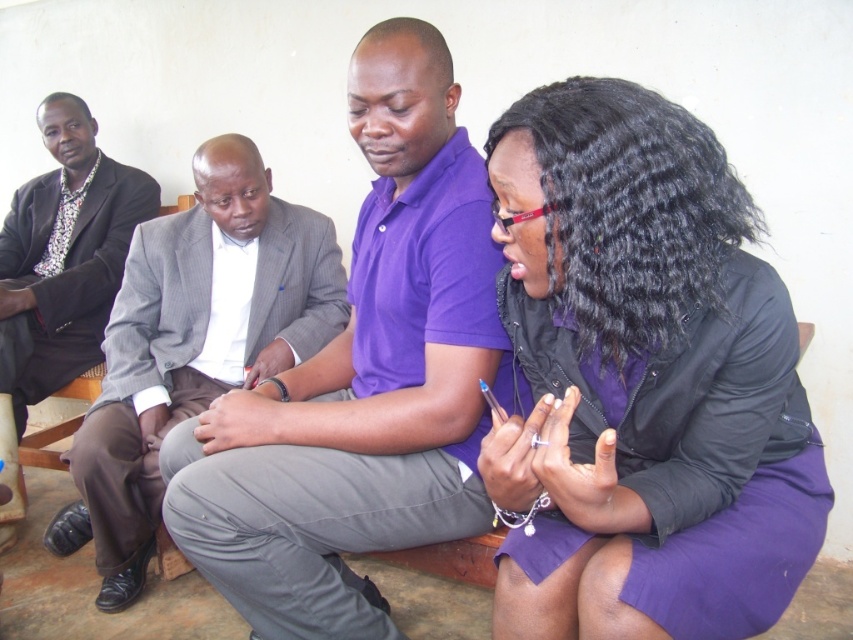
Does gray pinstripe suit at left appear over matte black suit at left?

No, gray pinstripe suit at left is not above matte black suit at left.

Can you confirm if gray pinstripe suit at left is positioned to the right of matte black suit at left?

Correct, you'll find gray pinstripe suit at left to the right of matte black suit at left.

The image size is (853, 640). Describe the element at coordinates (193, 344) in the screenshot. I see `gray pinstripe suit at left` at that location.

Where is `gray pinstripe suit at left`? The width and height of the screenshot is (853, 640). gray pinstripe suit at left is located at coordinates (193, 344).

Based on the photo, which of these two, purple matte skirt at lower right or gray pinstripe suit at left, stands shorter?

purple matte skirt at lower right is shorter.

Is purple matte skirt at lower right wider than gray pinstripe suit at left?

Incorrect, purple matte skirt at lower right's width does not surpass gray pinstripe suit at left's.

Who is more forward, (524, 621) or (161, 332)?

Point (524, 621) is in front.

Locate an element on the screen. purple matte skirt at lower right is located at coordinates (642, 380).

Is purple cotton polo shirt at center shorter than matte black suit at left?

Indeed, purple cotton polo shirt at center has a lesser height compared to matte black suit at left.

Is point (450, 490) farther from camera compared to point (3, 269)?

No.

The height and width of the screenshot is (640, 853). Identify the location of purple cotton polo shirt at center. (360, 380).